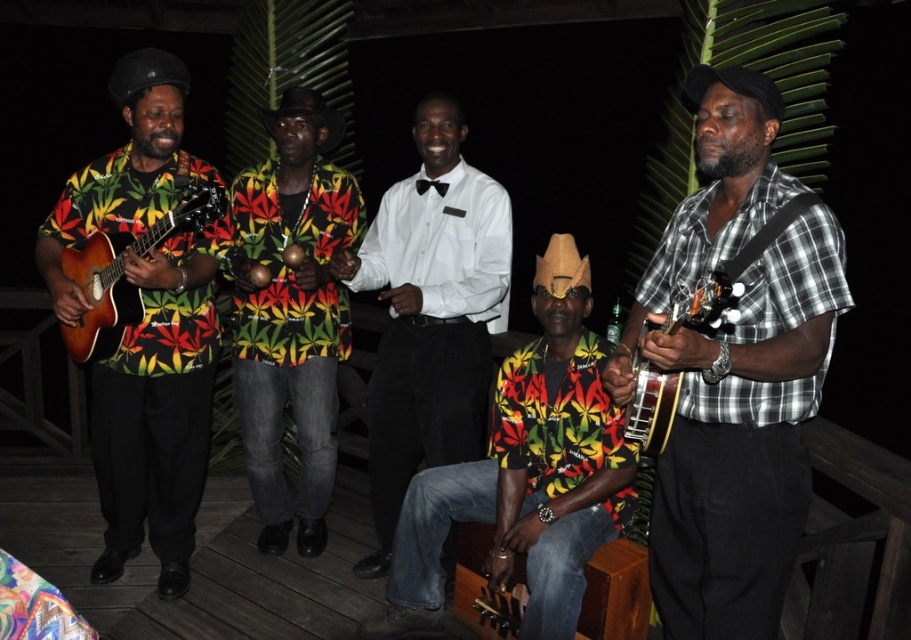
Question: Is white glossy shirt at center wider than matte brown banjo at right?

Choices:
 (A) yes
 (B) no

Answer: (A)

Question: Which is nearer to the plaid cotton shirt at right?

Choices:
 (A) white glossy shirt at center
 (B) printed fabric shirt at center

Answer: (A)

Question: Which of the following is the farthest from the observer?

Choices:
 (A) (663, 310)
 (B) (111, 262)
 (C) (540, 337)
 (D) (187, 385)

Answer: (C)

Question: Considering the relative positions of plaid cotton shirt at right and matte black guitar at left in the image provided, where is plaid cotton shirt at right located with respect to matte black guitar at left?

Choices:
 (A) left
 (B) right

Answer: (B)

Question: Among these objects, which one is farthest from the camera?

Choices:
 (A) floral-patterned shirt at center
 (B) matte wood guitar at left
 (C) matte brown banjo at right

Answer: (A)

Question: Observing the image, what is the correct spatial positioning of plaid cotton shirt at right in reference to matte wood guitar at left?

Choices:
 (A) above
 (B) below

Answer: (B)